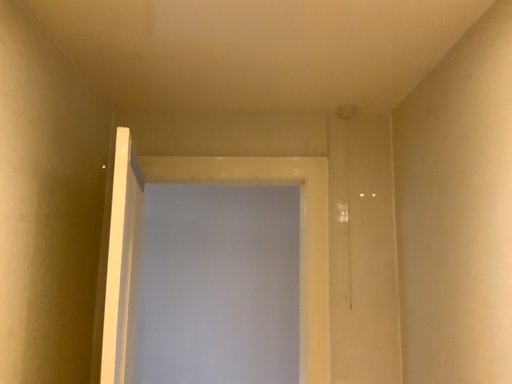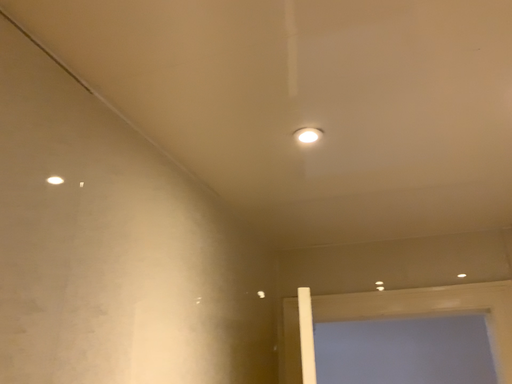
Question: How did the camera likely rotate when shooting the video?

Choices:
 (A) rotated right
 (B) rotated left

Answer: (B)